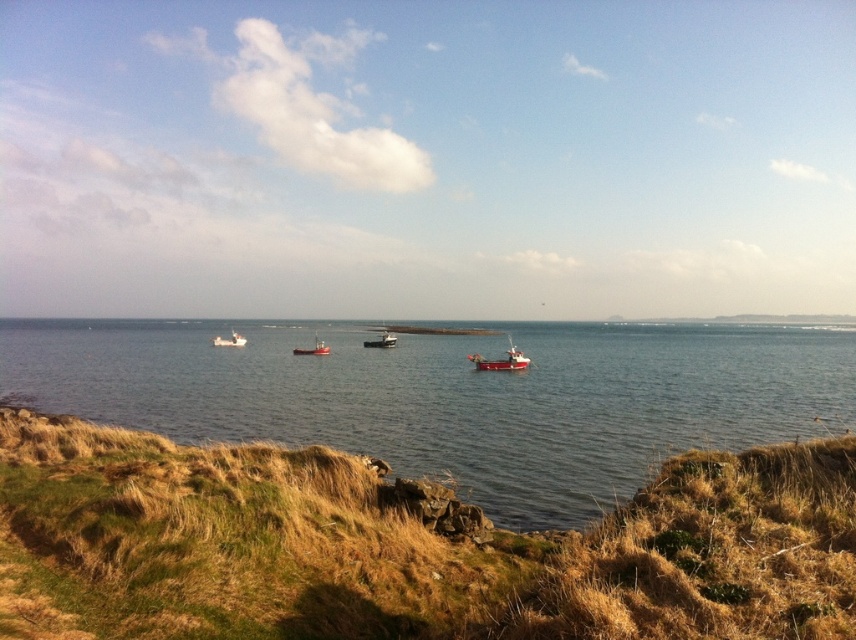
Question: Can you confirm if clear water at center is smaller than red matte fishing boat at lower center?

Choices:
 (A) no
 (B) yes

Answer: (A)

Question: Considering the relative positions of red matte fishing boat at lower center and white matte boat at center in the image provided, where is red matte fishing boat at lower center located with respect to white matte boat at center?

Choices:
 (A) below
 (B) above

Answer: (A)

Question: Which object appears farthest from the camera in this image?

Choices:
 (A) white matte boat at center
 (B) metallic silver boat at center
 (C) clear water at center
 (D) dry grass at lower left

Answer: (A)

Question: Does dry grass at lower left have a larger size compared to white matte boat at center?

Choices:
 (A) no
 (B) yes

Answer: (B)

Question: Which of the following is the closest to the observer?

Choices:
 (A) metallic silver boat at center
 (B) dry grass at lower left

Answer: (B)

Question: Which of the following is the closest to the observer?

Choices:
 (A) (321, 346)
 (B) (462, 616)

Answer: (B)